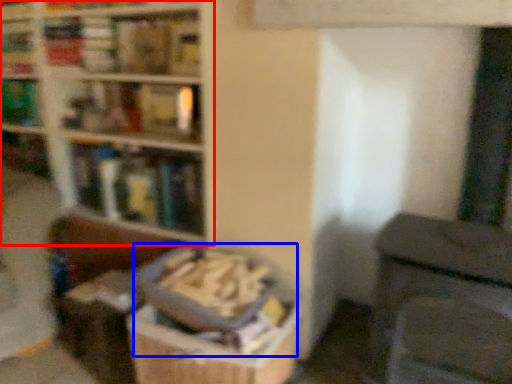
Question: Which object appears closest to the camera in this image, bookcase (highlighted by a red box) or book (highlighted by a blue box)?

Choices:
 (A) bookcase
 (B) book

Answer: (B)